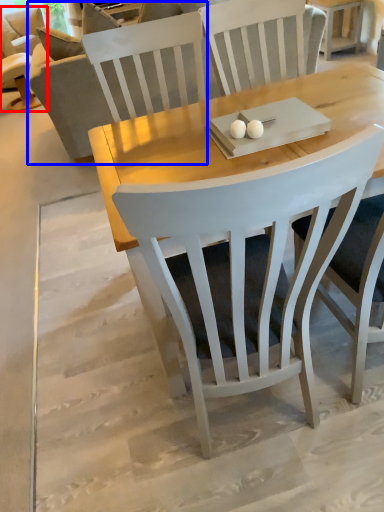
Question: Which object is further to the camera taking this photo, chair (highlighted by a red box) or couch (highlighted by a blue box)?

Choices:
 (A) chair
 (B) couch

Answer: (A)